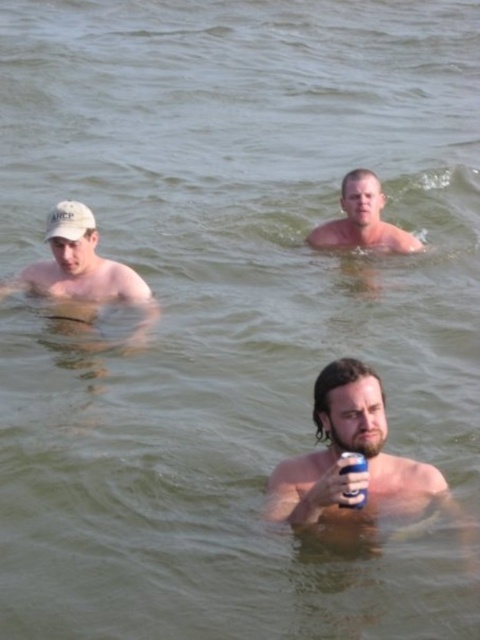
You are a photographer trying to capture a clear shot of the blue metallic can at lower center without the white matte cap at left obstructing it. Based on their positions, is this possible?

The white matte cap at left is to the left of the blue metallic can at lower center, so positioning the camera to the right side of the blue metallic can at lower center would allow capturing it without the white matte cap at left blocking the view.

You are trying to determine the relative sizes of the bearded man at center and the white matte cap at left in the image. Based on their positions in the water, which one appears larger?

The white matte cap at left appears larger than the bearded man at center because the bearded man at center is smaller than the white matte cap at left.

You are a photographer trying to capture a clear shot of the blue metallic can at lower center without the smooth skin man at center blocking it. Can you adjust your position to avoid the man?

The smooth skin man at center might be wider than blue metallic can at lower center, so adjusting your position might help avoid the obstruction.